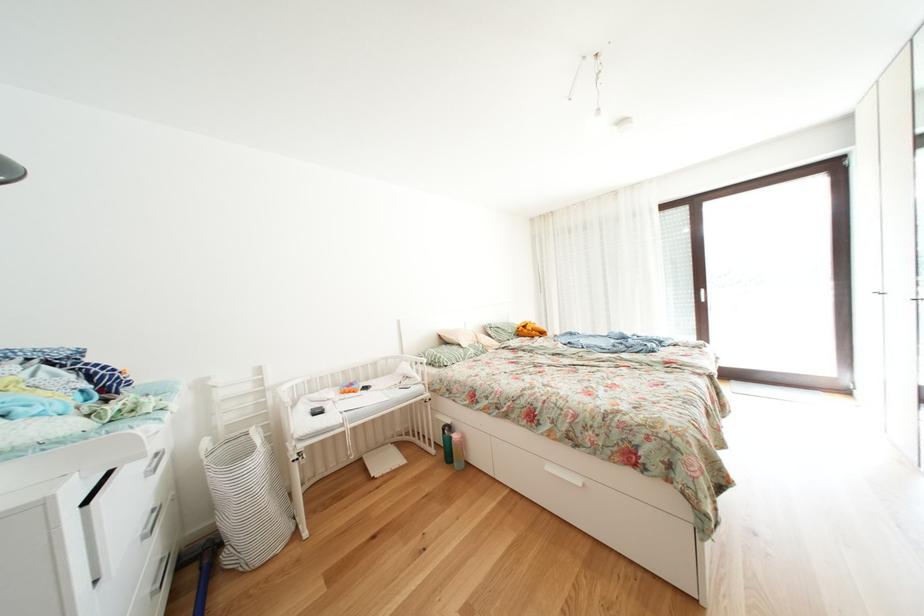
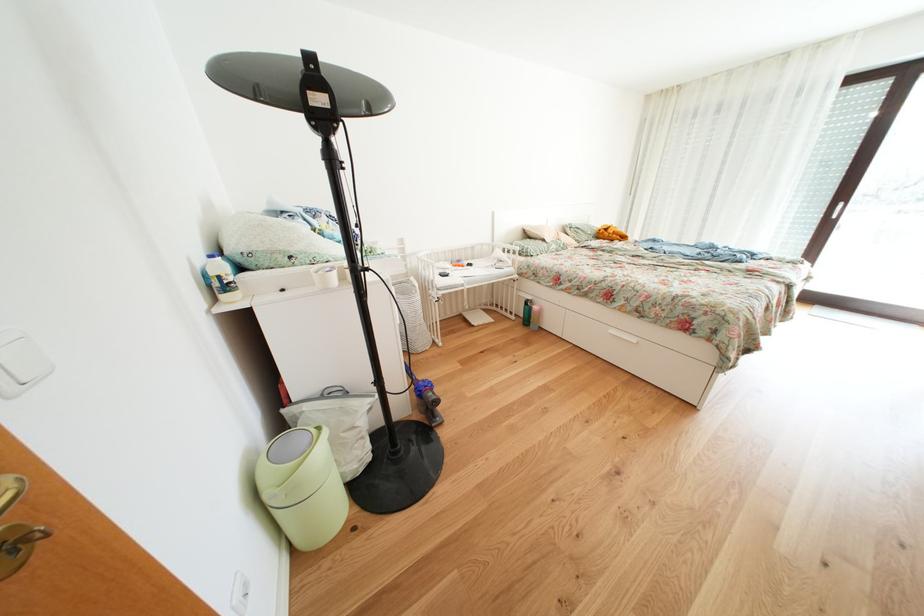
Locate, in the second image, the point that corresponds to (458,432) in the first image.

(541, 307)